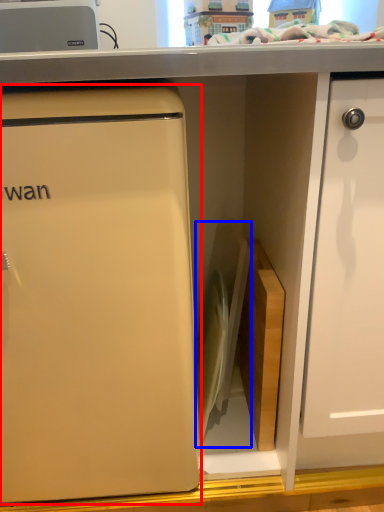
Question: Which point is further to the camera, refrigerator (highlighted by a red box) or appliance (highlighted by a blue box)?

Choices:
 (A) refrigerator
 (B) appliance

Answer: (B)